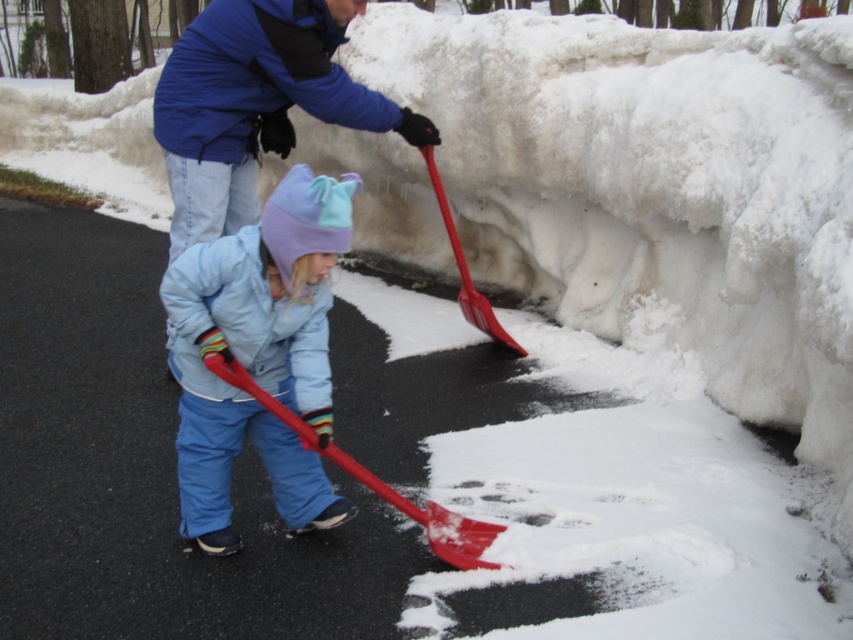
Question: Where is light blue fleece jacket at center located in relation to red plastic shovel at upper center in the image?

Choices:
 (A) below
 (B) above

Answer: (A)

Question: Is blue fleece jacket at upper center above red plastic shovel at lower center?

Choices:
 (A) yes
 (B) no

Answer: (A)

Question: Which point appears closest to the camera in this image?

Choices:
 (A) (143, 275)
 (B) (219, 252)
 (C) (173, 182)
 (D) (431, 506)

Answer: (B)

Question: Can you confirm if red plastic shovel at center is smaller than red plastic shovel at upper center?

Choices:
 (A) yes
 (B) no

Answer: (A)

Question: Which point is closer to the camera?

Choices:
 (A) click(379, 332)
 (B) click(392, 486)
 (C) click(344, 116)
 (D) click(445, 209)

Answer: (B)

Question: Which point is farther from the camera taking this photo?

Choices:
 (A) (366, 484)
 (B) (338, 180)
 (C) (206, 88)
 (D) (440, 188)

Answer: (B)